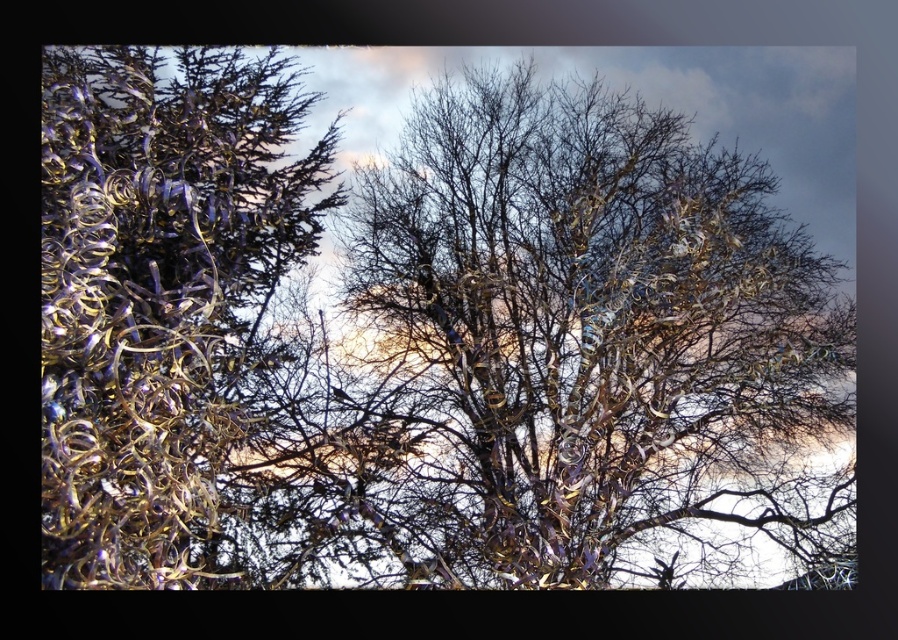
You are an artist planning to paint the surreal scene described. You need to ensure that the metallic gold tree at center and the metallic gold tinsel at left are proportionally accurate. Based on the scene, which object should you depict as larger?

The metallic gold tree at center should be depicted as larger than the metallic gold tinsel at left since it has a larger size compared to it according to the description.

You are an artist analyzing the composition of the scene. Given the coordinates of the metallic gold tree at center, how does its position affect the balance of the image compared to the other elements?

The metallic gold tree at center is located at point (557, 352), which places it slightly off the exact center horizontally and vertically. This positioning creates a dynamic balance by shifting visual weight towards the lower right, contrasting with the dense foliage on the left and the bare branches on the right, thus harmonizing the elements without being symmetrical.

From the picture: You are an artist analyzing the composition of the image. You notice a point at coordinates (557, 352). Which object in the scene does this point correspond to?

The point at coordinates (557, 352) corresponds to the metallic gold tree at center.